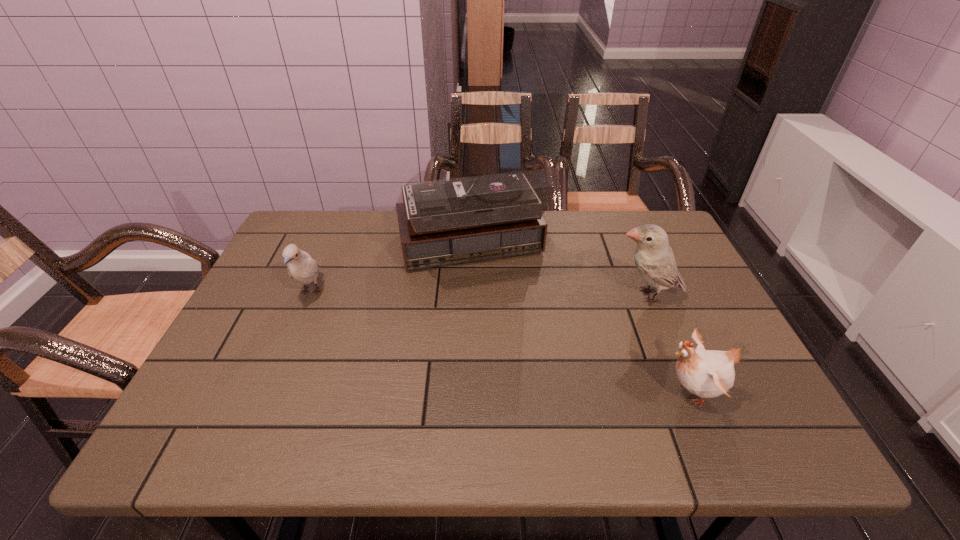
You are a GUI agent. You are given a task and a screenshot of the screen. Output one action in this format:
    pyautogui.click(x=<x>, y=<y>)
    Task: Click on the vacant space located 0.250m at the beak of the nearest object
    
    Given the screenshot: What is the action you would take?
    pyautogui.click(x=540, y=392)

I want to click on blank space located 0.100m at the beak of the nearest object, so [x=612, y=392].

Find the location of a particular element. This screenshot has width=960, height=540. free region located at the beak of the nearest object is located at coordinates (507, 392).

In order to click on object at the far edge in this screenshot , I will do `click(451, 221)`.

The height and width of the screenshot is (540, 960). What are the coordinates of `object located at the near edge` in the screenshot? It's located at (706, 373).

Image resolution: width=960 pixels, height=540 pixels. I want to click on object that is at the left edge, so click(301, 267).

The width and height of the screenshot is (960, 540). I want to click on object at the near right corner, so click(706, 373).

The image size is (960, 540). What are the coordinates of `free space at the far edge of the desktop` in the screenshot? It's located at (567, 225).

Find the location of a particular element. The image size is (960, 540). free spot at the near edge of the desktop is located at coordinates (575, 439).

This screenshot has height=540, width=960. I want to click on free space at the left edge of the desktop, so click(x=212, y=404).